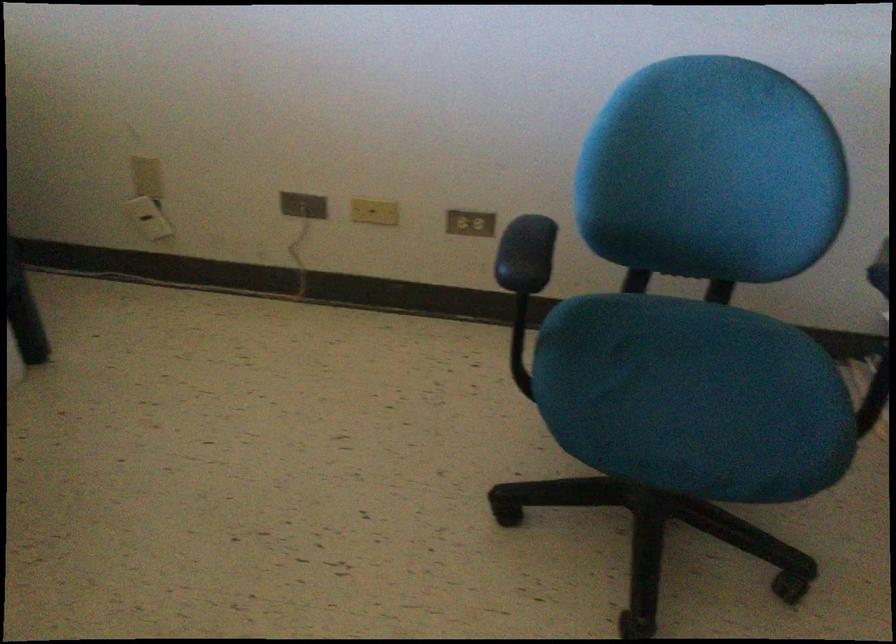
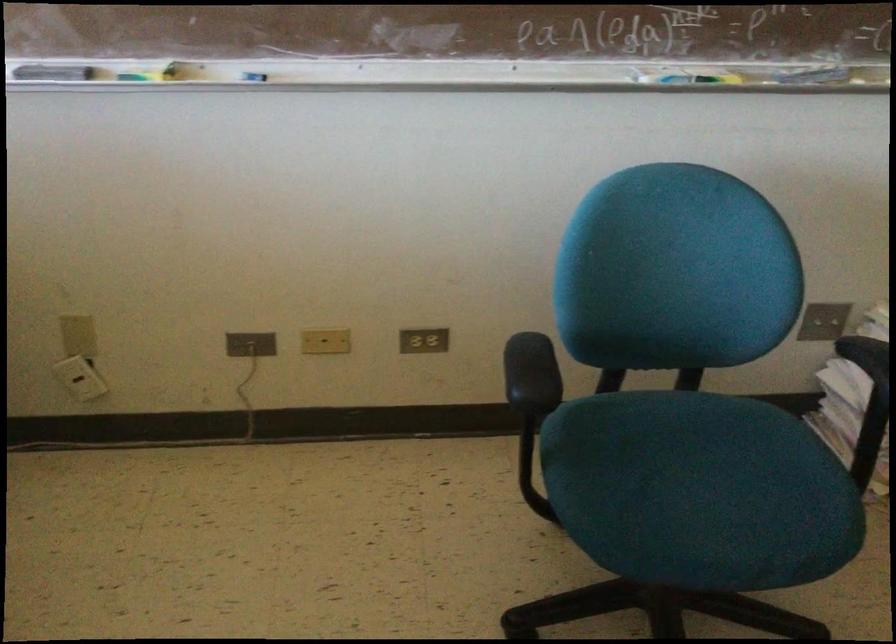
Find the pixel in the second image that matches (372,214) in the first image.

(325, 341)